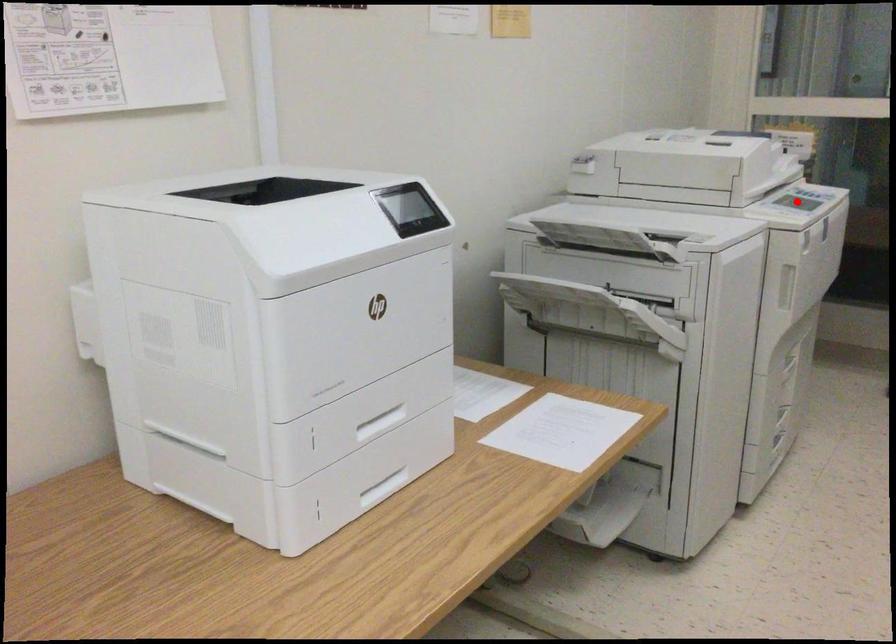
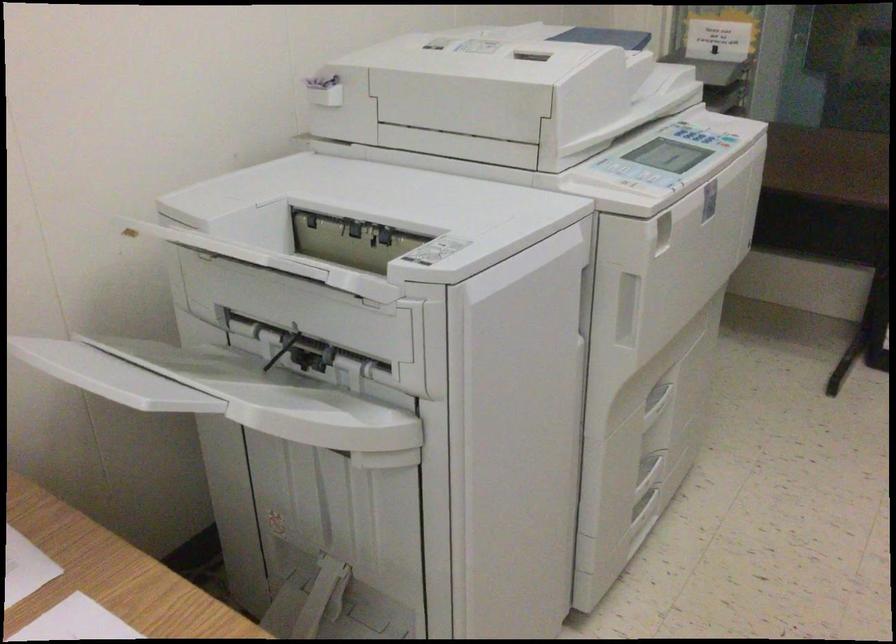
Find the pixel in the second image that matches the highlighted location in the first image.

(668, 155)